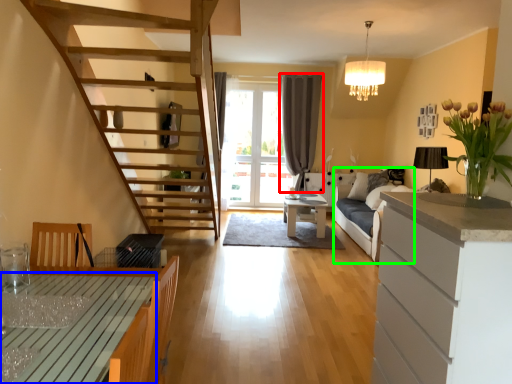
Question: Based on their relative distances, which object is farther from curtain (highlighted by a red box)? Choose from table (highlighted by a blue box) and couch (highlighted by a green box).

Choices:
 (A) table
 (B) couch

Answer: (A)